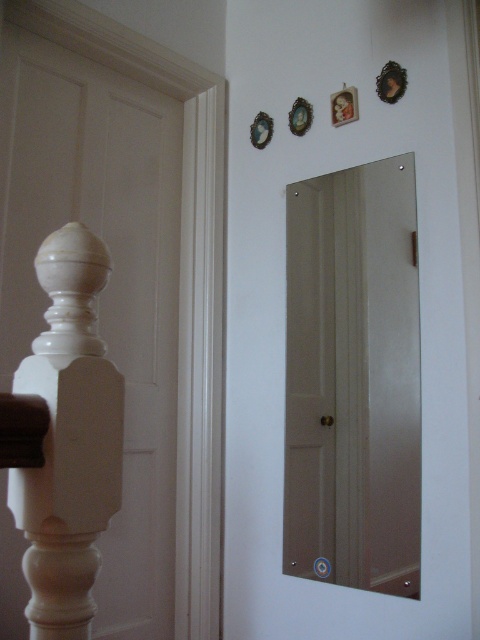
Question: Which object appears closest to the camera in this image?

Choices:
 (A) white matte wooden post at left
 (B) clear glass mirror at center
 (C) matte white balustrade at left

Answer: (C)

Question: Is clear glass mirror at center bigger than matte white balustrade at left?

Choices:
 (A) no
 (B) yes

Answer: (B)

Question: Is white matte wooden door at left to the left of white matte wooden post at left from the viewer's perspective?

Choices:
 (A) no
 (B) yes

Answer: (B)

Question: Which point is farther to the camera?

Choices:
 (A) (34, 401)
 (B) (355, 324)

Answer: (B)

Question: Which object is the farthest from the white matte wooden door at left?

Choices:
 (A) matte white balustrade at left
 (B) clear glass mirror at center
 (C) white matte wooden post at left

Answer: (A)

Question: From the image, what is the correct spatial relationship of white matte wooden door at left in relation to white matte wooden post at left?

Choices:
 (A) above
 (B) below

Answer: (B)